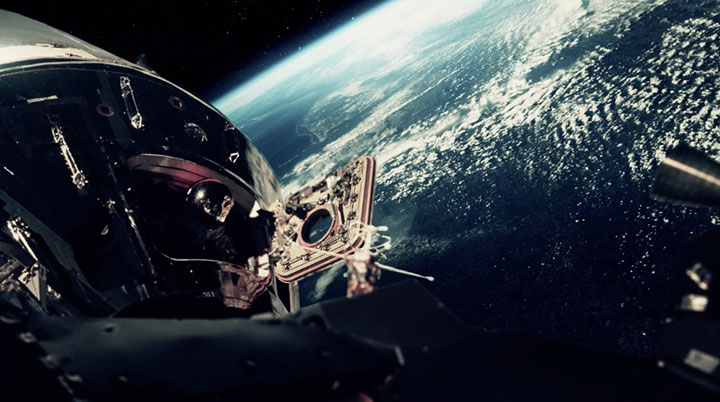
Find the location of `door frame`. door frame is located at coordinates point(176,169).